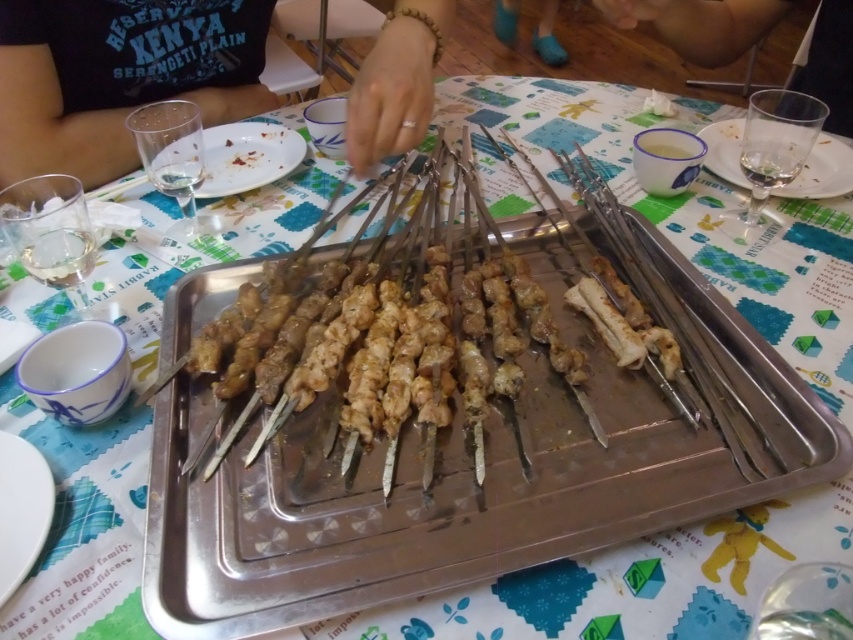
You are setting up for a barbecue and need to choose between the white ceramic plate at lower left and the clear glass at upper right to serve a stack of chicken kebabs. Which one can better support the weight without breaking?

The white ceramic plate at lower left is thinner than clear glass at upper right, so the clear glass at upper right is thicker and more durable, making it better for supporting the weight of the chicken kebabs without breaking.

You are at a barbecue and see the brown matte skewers at center and the brown leather hand at upper right. Which object is closer to the left edge of the table?

The brown matte skewers at center are closer to the left edge of the table because they are positioned on the left side of the brown leather hand at upper right.

You are a guest at a barbecue and want to grab a plate from the table. You see the matte black shirt at upper left and the white ceramic plate at lower left. Which object is closer to you so you can reach it easily?

The matte black shirt at upper left is closer to you than the white ceramic plate at lower left, so you can reach it easily.